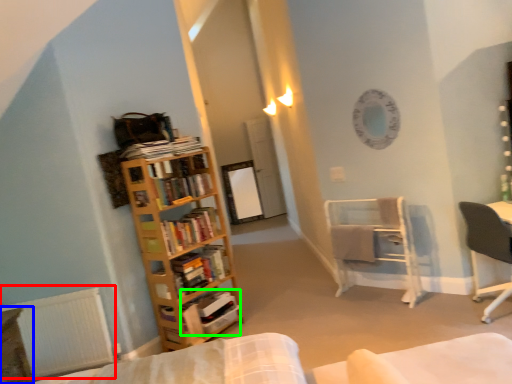
Question: Which object is the farthest from radiator (highlighted by a red box)? Choose among these: table (highlighted by a blue box) or book (highlighted by a green box).

Choices:
 (A) table
 (B) book

Answer: (B)